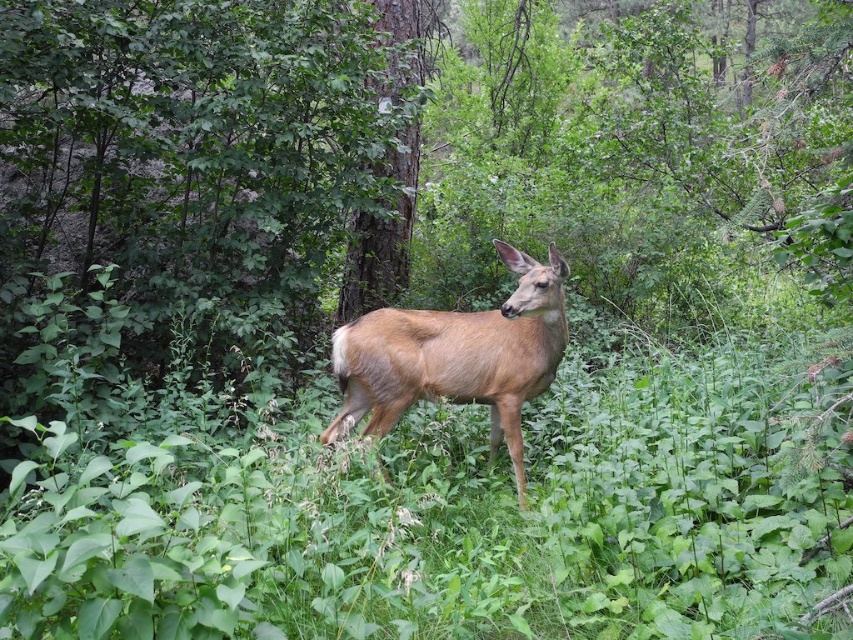
You are a hiker in the forest and want to find a clear path. You notice the green leafy grass at center and the brown matte deer at center. Which object is taller?

The brown matte deer at center is taller than the green leafy grass at center.

You are a hiker who wants to place a small marker at the exact center of the image. You see the point marked at point (460, 518). Is the green leafy grass at center located exactly at that point?

Yes, the green leafy grass at center is located exactly at point (460, 518).